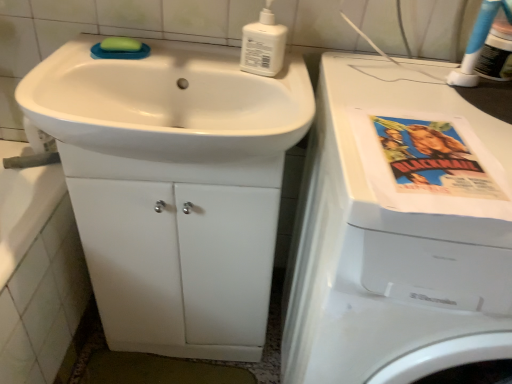
Question: Does white plastic bottle at upper center appear on the left side of white glossy cabinet at center?

Choices:
 (A) no
 (B) yes

Answer: (A)

Question: From a real-world perspective, is white plastic bottle at upper center positioned under white glossy cabinet at center based on gravity?

Choices:
 (A) yes
 (B) no

Answer: (B)

Question: Is white plastic bottle at upper center looking in the opposite direction of white glossy cabinet at center?

Choices:
 (A) yes
 (B) no

Answer: (B)

Question: Does white plastic bottle at upper center have a smaller size compared to white glossy cabinet at center?

Choices:
 (A) no
 (B) yes

Answer: (B)

Question: Can you confirm if white plastic bottle at upper center is thinner than white glossy cabinet at center?

Choices:
 (A) yes
 (B) no

Answer: (A)

Question: Is white plastic bottle at upper center completely or partially outside of white glossy cabinet at center?

Choices:
 (A) no
 (B) yes

Answer: (B)

Question: Is white plastic bottle at upper center facing away from white glossy sink at center?

Choices:
 (A) no
 (B) yes

Answer: (A)

Question: Is white plastic bottle at upper center not near white glossy sink at center?

Choices:
 (A) no
 (B) yes

Answer: (A)

Question: Is white plastic bottle at upper center closer to the viewer compared to white glossy sink at center?

Choices:
 (A) yes
 (B) no

Answer: (B)

Question: From the image's perspective, would you say white plastic bottle at upper center is shown under white glossy sink at center?

Choices:
 (A) yes
 (B) no

Answer: (B)

Question: Is white plastic bottle at upper center directly adjacent to white glossy sink at center?

Choices:
 (A) no
 (B) yes

Answer: (A)

Question: Considering the relative sizes of white plastic bottle at upper center and white glossy sink at center in the image provided, is white plastic bottle at upper center wider than white glossy sink at center?

Choices:
 (A) yes
 (B) no

Answer: (B)

Question: Is green matte soap at upper left inside white plastic washing machine at right?

Choices:
 (A) no
 (B) yes

Answer: (A)